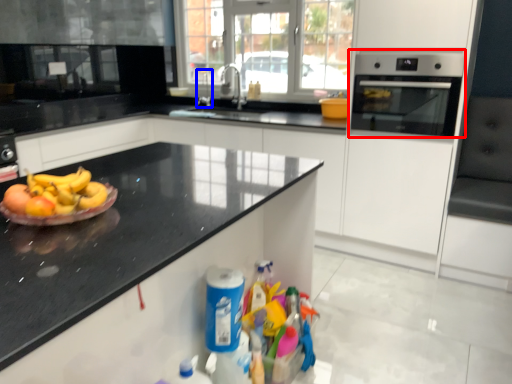
Question: Which of the following is the closest to the observer, home appliance (highlighted by a red box) or faucet (highlighted by a blue box)?

Choices:
 (A) home appliance
 (B) faucet

Answer: (A)